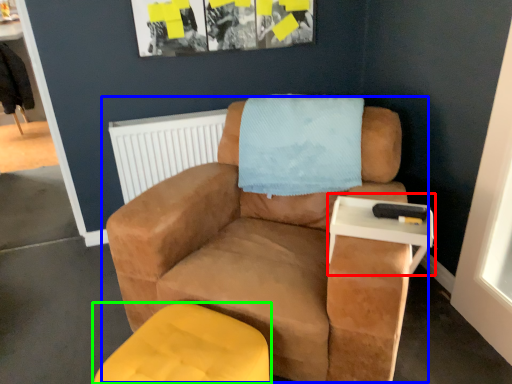
Question: Which is farther away from table (highlighted by a red box)? chair (highlighted by a blue box) or furniture (highlighted by a green box)?

Choices:
 (A) chair
 (B) furniture

Answer: (B)